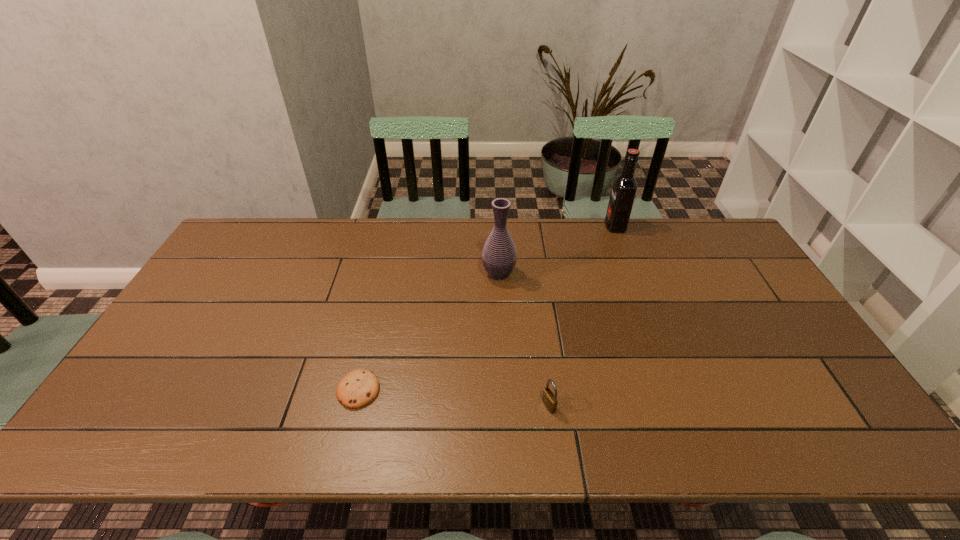
This screenshot has width=960, height=540. I want to click on vacant area situated on the front-facing side of the rightmost object, so click(x=514, y=226).

Image resolution: width=960 pixels, height=540 pixels. What are the coordinates of `free location located 0.070m on the back of the third object from right to left` in the screenshot? It's located at coord(497,250).

You are a GUI agent. You are given a task and a screenshot of the screen. Output one action in this format:
    pyautogui.click(x=<x>, y=<y>)
    Task: Click on the vacant region located 0.050m on the back of the second shortest object
    The image size is (960, 540).
    Given the screenshot: What is the action you would take?
    [545, 380]

You are a GUI agent. You are given a task and a screenshot of the screen. Output one action in this format:
    pyautogui.click(x=<x>, y=<y>)
    Task: Click on the free region located 0.070m on the front of the leftmost object
    The width and height of the screenshot is (960, 540).
    Given the screenshot: What is the action you would take?
    pyautogui.click(x=347, y=437)

The image size is (960, 540). What are the coordinates of `object that is at the far edge` in the screenshot? It's located at pyautogui.click(x=624, y=187).

This screenshot has width=960, height=540. In order to click on object that is at the near edge in this screenshot , I will do `click(549, 399)`.

Where is `vacant space at the far edge`? The height and width of the screenshot is (540, 960). vacant space at the far edge is located at coordinates (439, 240).

Locate an element on the screen. The image size is (960, 540). free space at the near edge of the desktop is located at coordinates (681, 437).

This screenshot has width=960, height=540. I want to click on vacant space at the left edge of the desktop, so click(x=222, y=286).

At what (x,y) coordinates should I click in order to perform the action: click on vacant region at the right edge. Please return your answer as a coordinate pair (x, y). The height and width of the screenshot is (540, 960). Looking at the image, I should click on (788, 377).